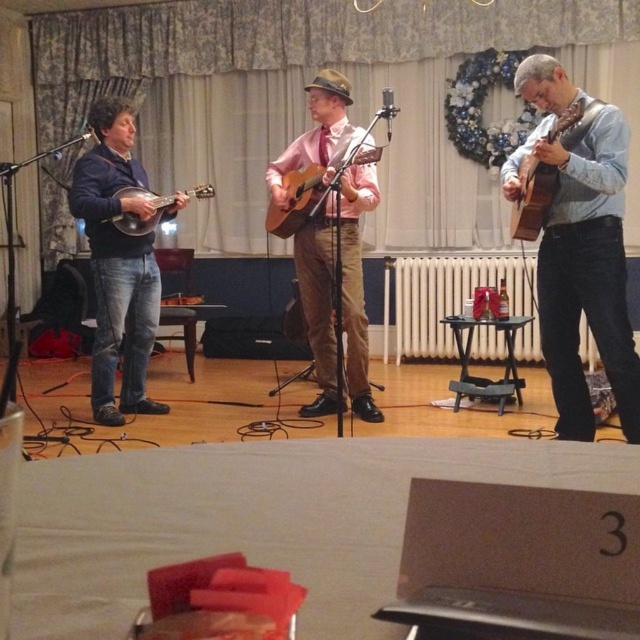
In the scene shown: Is matte pink shirt at center positioned at the back of acoustic wood guitar at center?

That is True.

Who is positioned more to the left, matte pink shirt at center or acoustic wood guitar at center?

acoustic wood guitar at center

The width and height of the screenshot is (640, 640). What do you see at coordinates (356, 285) in the screenshot? I see `matte pink shirt at center` at bounding box center [356, 285].

The width and height of the screenshot is (640, 640). I want to click on matte pink shirt at center, so click(x=356, y=285).

Who is taller, brown wooden guitar at right or matte wood mandolin at left?

brown wooden guitar at right is taller.

Is brown wooden guitar at right to the left of matte wood mandolin at left from the viewer's perspective?

In fact, brown wooden guitar at right is to the right of matte wood mandolin at left.

The height and width of the screenshot is (640, 640). I want to click on brown wooden guitar at right, so click(x=532, y=198).

Which is in front, point (291, 198) or point (134, 216)?

Point (291, 198)

This screenshot has height=640, width=640. What are the coordinates of `acoustic wood guitar at center` in the screenshot? It's located at (296, 200).